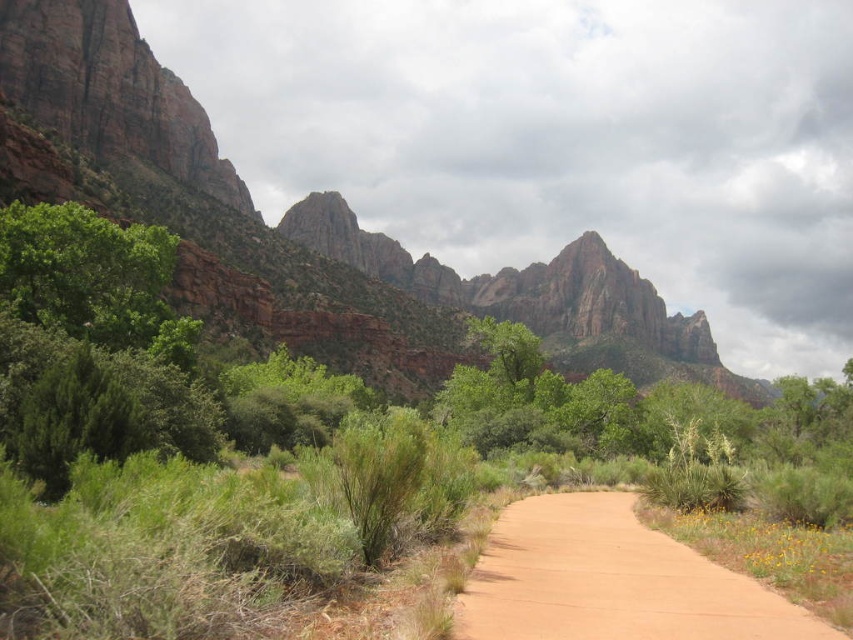
Between point (148, 436) and point (685, 326), which one is positioned behind?

Positioned behind is point (685, 326).

Can you confirm if green leafy shrubs at center is positioned below rustic rock formation at upper center?

Indeed, green leafy shrubs at center is positioned under rustic rock formation at upper center.

Where is `green leafy shrubs at center`? green leafy shrubs at center is located at coordinates (253, 467).

Find the location of `green leafy shrubs at center`. green leafy shrubs at center is located at coordinates (253, 467).

Does green leafy shrubs at center appear on the left side of sandy dirt path at center?

Indeed, green leafy shrubs at center is positioned on the left side of sandy dirt path at center.

The height and width of the screenshot is (640, 853). What do you see at coordinates (253, 467) in the screenshot? I see `green leafy shrubs at center` at bounding box center [253, 467].

At what (x,y) coordinates should I click in order to perform the action: click on green leafy shrubs at center. Please return your answer as a coordinate pair (x, y). Image resolution: width=853 pixels, height=640 pixels. Looking at the image, I should click on (253, 467).

Can you confirm if rustic rock formation at upper center is taller than sandy dirt path at center?

Yes.

Is rustic rock formation at upper center closer to the viewer compared to sandy dirt path at center?

No, rustic rock formation at upper center is behind sandy dirt path at center.

Who is more forward, (142, 163) or (546, 497)?

Point (546, 497) is in front.

This screenshot has width=853, height=640. Find the location of `rustic rock formation at upper center`. rustic rock formation at upper center is located at coordinates (537, 296).